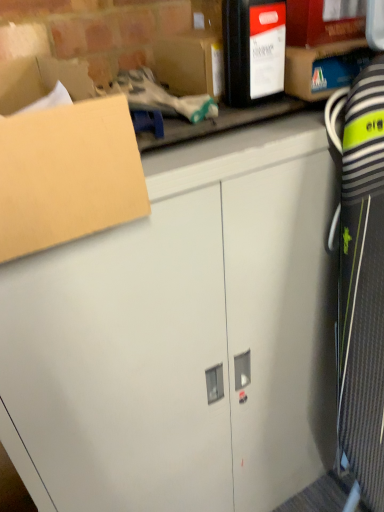
Question: In terms of size, does matte cardboard box at upper right, the 2th storage box when ordered from left to right, appear bigger or smaller than brown cardboard box at upper left?

Choices:
 (A) small
 (B) big

Answer: (A)

Question: Considering their positions, is matte cardboard box at upper right, the 2th storage box when ordered from left to right, located in front of or behind brown cardboard box at upper left?

Choices:
 (A) behind
 (B) front

Answer: (A)

Question: Which of these objects is positioned farthest from the white matte cabinet at center?

Choices:
 (A) matte cardboard box at upper right, the 2th storage box when ordered from left to right
 (B) matte black box at upper center, which ranks as the 1th storage box in left-to-right order
 (C) brown cardboard box at upper left

Answer: (A)

Question: Which is farther from the matte cardboard box at upper right, which is counted as the 1th storage box, starting from the right?

Choices:
 (A) matte black box at upper center, placed as the second storage box when sorted from right to left
 (B) brown cardboard box at upper left
 (C) white matte cabinet at center

Answer: (C)